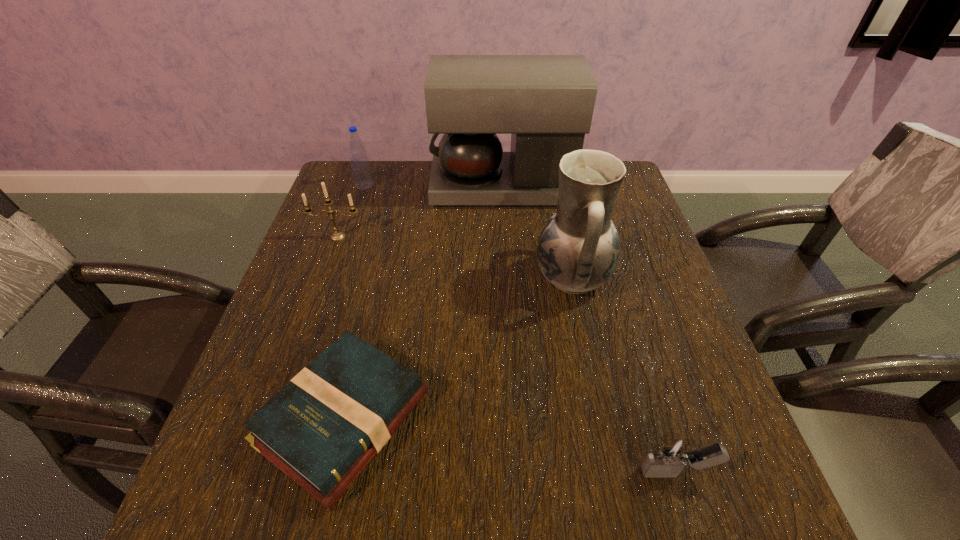
Identify the location of blank area located on the front-facing side of the third nearest object. The height and width of the screenshot is (540, 960). (388, 278).

Image resolution: width=960 pixels, height=540 pixels. What are the coordinates of `free point located 0.120m on the front-facing side of the third nearest object` in the screenshot? It's located at (482, 278).

I want to click on vacant area situated on the front of the water bottle, so click(x=344, y=250).

I want to click on vacant region located 0.070m on the back of the fourth nearest object, so click(x=346, y=215).

At what (x,y) coordinates should I click in order to perform the action: click on vacant space located 0.120m on the back of the igniter. Please return your answer as a coordinate pair (x, y). The width and height of the screenshot is (960, 540). Looking at the image, I should click on (651, 389).

Find the location of a particular element. Image resolution: width=960 pixels, height=540 pixels. blank space located on the right of the hardback book is located at coordinates (455, 418).

Find the location of a particular element. This screenshot has height=540, width=960. coffee maker that is at the far edge is located at coordinates (546, 102).

Image resolution: width=960 pixels, height=540 pixels. I want to click on water bottle located at the far edge, so click(361, 170).

What are the coordinates of `igniter located at the near edge` in the screenshot? It's located at (673, 452).

Where is `hardback book located at the near edge`? hardback book located at the near edge is located at coordinates [x=322, y=429].